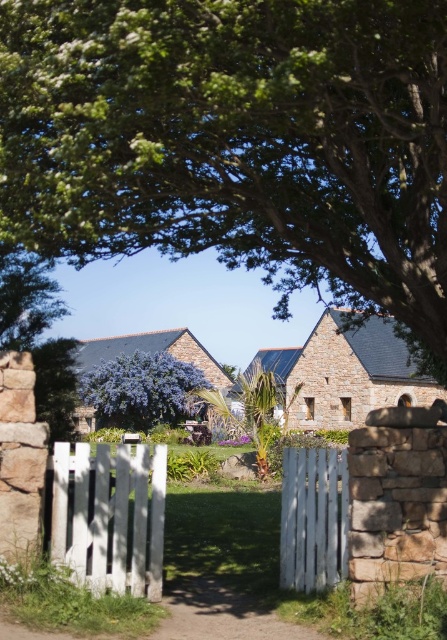
You are standing at the white wooden gate and want to walk towards the stone house. Which point, point (26, 38) or point (75, 561), is closer to you as you face the gate?

Point (26, 38) is closer to you because it is in front of point (75, 561).

You are standing in front of the stone house and want to enter through the entrance. The white wooden gate at center and the white wooden fence at center are both in your way. Which one do you need to go around to reach the entrance?

The white wooden gate at center is taller than the white wooden fence at center, so you would need to go around the white wooden fence at center to reach the entrance since it is shorter and easier to navigate around.

You are standing in front of the stone house and want to enter through the entrance. Which object should you approach first, the white wooden gate at center or the white wooden fence at center?

You should approach the white wooden gate at center first because it is positioned on the left side of the white wooden fence at center, making it closer to the entrance.